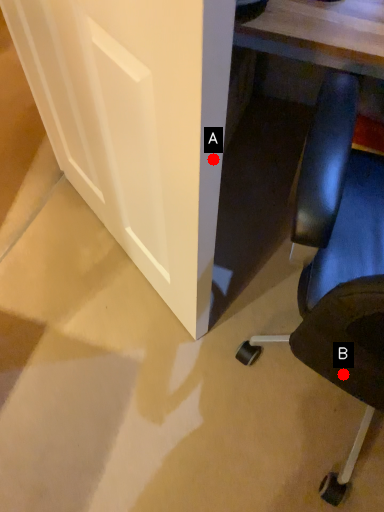
Question: Two points are circled on the image, labeled by A and B beside each circle. Among these points, which one is nearest to the camera?

Choices:
 (A) A is closer
 (B) B is closer

Answer: (A)